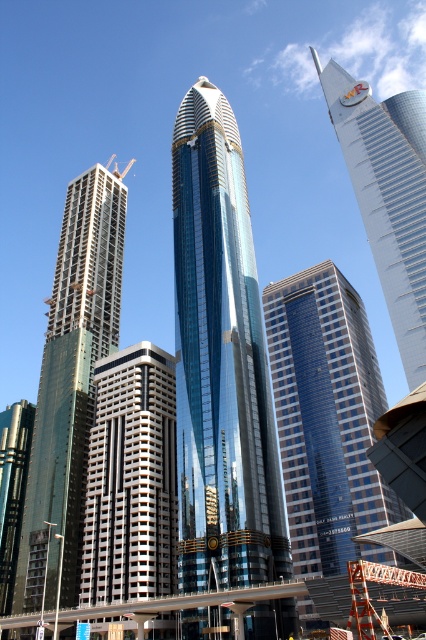
You are a city planner analyzing the urban layout. You need to determine the order of buildings from closest to farthest. Which is closer to you between the gray concrete building at center and the yellow metallic crane at upper left?

The gray concrete building at center is closer to the viewer than the yellow metallic crane at upper left.

You are a drone operator tasked with flying a drone between the green glass building at left and the glassy blue skyscraper at upper right. The drone has a maximum flight distance of 200 feet. Can the drone safely make this trip without exceeding its range?

The green glass building at left is 205.32 feet away from the glassy blue skyscraper at upper right. Since the distance exceeds the drone operator has a maximum flight distance of 200 feet, the drone cannot safely make this trip without exceeding its range.

You are an architect evaluating the urban layout. Which of the two buildings, the green glass building at left or the glassy blue skyscraper at upper right, has a narrower width?

The green glass building at left has a narrower width than the glassy blue skyscraper at upper right.